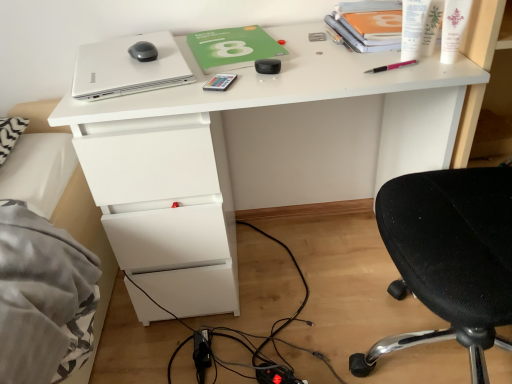
Where is `free space between metallic rectangular object at center, which is the fourth stationery in right-to-left order, and white glossy cream at upper right`? The width and height of the screenshot is (512, 384). free space between metallic rectangular object at center, which is the fourth stationery in right-to-left order, and white glossy cream at upper right is located at coordinates (315, 75).